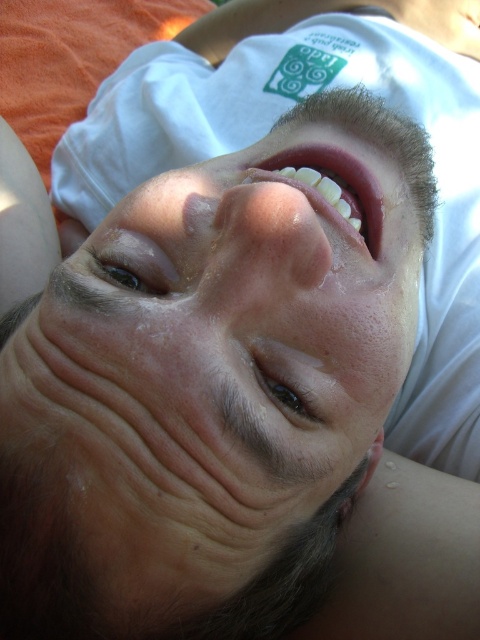
Question: Can you confirm if pink glossy lips at center is positioned to the left of brown shiny eye at upper center?

Choices:
 (A) no
 (B) yes

Answer: (A)

Question: Can you confirm if pink glossy lips at center is thinner than brown shiny eye at upper center?

Choices:
 (A) yes
 (B) no

Answer: (B)

Question: Which object is closer to the camera taking this photo?

Choices:
 (A) brown glossy eye at center
 (B) dry skin at center
 (C) brown shiny eye at upper center

Answer: (B)

Question: Is brown glossy eye at center wider than brown shiny eye at upper center?

Choices:
 (A) no
 (B) yes

Answer: (A)

Question: Which object is closer to the camera taking this photo?

Choices:
 (A) brown shiny eye at upper center
 (B) dry skin at center

Answer: (B)

Question: Based on their relative distances, which object is nearer to the pink glossy lips at center?

Choices:
 (A) brown shiny eye at upper center
 (B) dry skin at center
 (C) brown glossy eye at center

Answer: (A)